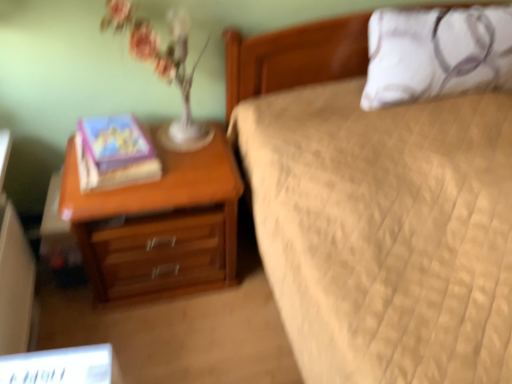
Question: Does wooden nightstand at left come in front of matte purple book at left?

Choices:
 (A) yes
 (B) no

Answer: (A)

Question: Considering the relative sizes of wooden nightstand at left and matte purple book at left in the image provided, is wooden nightstand at left bigger than matte purple book at left?

Choices:
 (A) yes
 (B) no

Answer: (A)

Question: Is wooden nightstand at left not inside matte purple book at left?

Choices:
 (A) yes
 (B) no

Answer: (A)

Question: Does wooden nightstand at left turn towards matte purple book at left?

Choices:
 (A) yes
 (B) no

Answer: (B)

Question: Considering the relative positions of wooden nightstand at left and matte purple book at left in the image provided, is wooden nightstand at left to the right of matte purple book at left from the viewer's perspective?

Choices:
 (A) yes
 (B) no

Answer: (A)

Question: From their relative heights in the image, would you say translucent glass vase at upper left is taller or shorter than white textured pillow at upper right?

Choices:
 (A) short
 (B) tall

Answer: (B)

Question: Considering their positions, is translucent glass vase at upper left located in front of or behind white textured pillow at upper right?

Choices:
 (A) behind
 (B) front

Answer: (B)

Question: Visually, is translucent glass vase at upper left positioned to the left or to the right of white textured pillow at upper right?

Choices:
 (A) left
 (B) right

Answer: (A)

Question: Is translucent glass vase at upper left wider or thinner than white textured pillow at upper right?

Choices:
 (A) thin
 (B) wide

Answer: (A)

Question: From a real-world perspective, is white textured pillow at upper right physically located above or below matte purple book at left?

Choices:
 (A) below
 (B) above

Answer: (B)

Question: Considering the positions of point (396, 97) and point (105, 185), is point (396, 97) closer or farther from the camera than point (105, 185)?

Choices:
 (A) closer
 (B) farther

Answer: (B)

Question: Looking at their shapes, would you say white textured pillow at upper right is wider or thinner than matte purple book at left?

Choices:
 (A) thin
 (B) wide

Answer: (A)

Question: From the image's perspective, is white textured pillow at upper right located above or below matte purple book at left?

Choices:
 (A) above
 (B) below

Answer: (A)

Question: From the image's perspective, is matte purple book at left located above or below white textured pillow at upper right?

Choices:
 (A) below
 (B) above

Answer: (A)

Question: Is point (115, 119) closer or farther from the camera than point (364, 99)?

Choices:
 (A) closer
 (B) farther

Answer: (A)